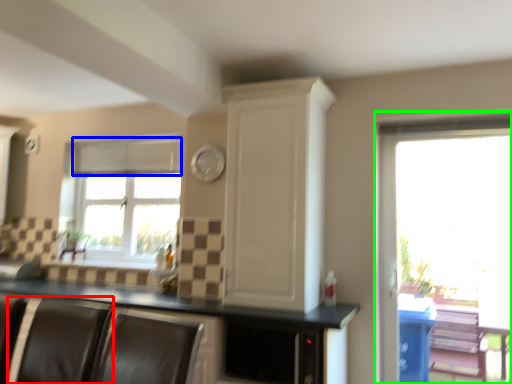
Question: Considering the real-world distances, which object is closest to armchair (highlighted by a red box)? blind (highlighted by a blue box) or window (highlighted by a green box).

Choices:
 (A) blind
 (B) window

Answer: (A)